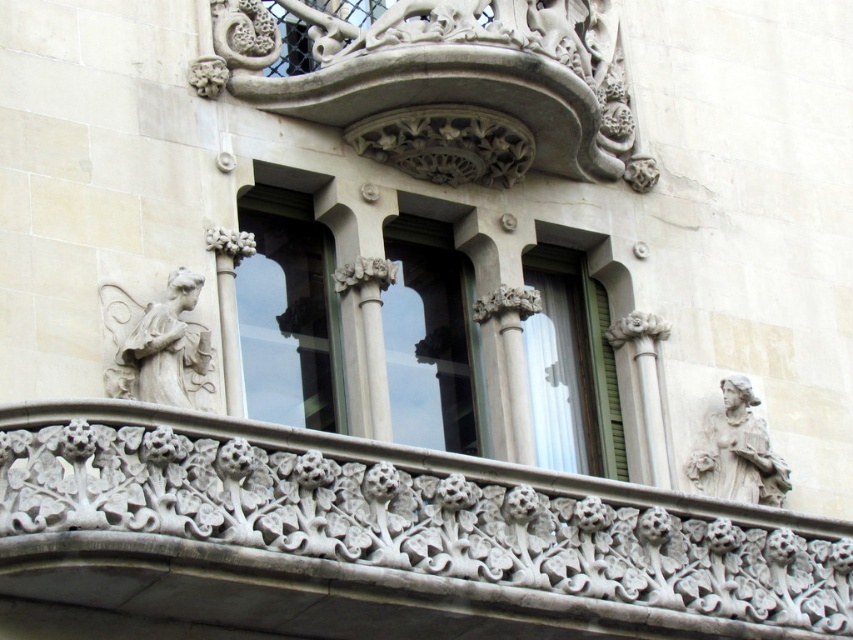
Find the location of a particular element. This screenshot has height=640, width=853. white stone carving at center is located at coordinates (386, 536).

Can you confirm if transparent glass window at center is positioned above clear glass window at center?

Correct, transparent glass window at center is located above clear glass window at center.

Is transparent glass window at center closer to the viewer compared to clear glass window at center?

No, transparent glass window at center is further to the viewer.

Is point (251, 212) less distant than point (469, 342)?

Yes.

This screenshot has height=640, width=853. Identify the location of transparent glass window at center. (288, 314).

Find the location of a particular element. The image size is (853, 640). transparent glass window at center is located at coordinates (288, 314).

Is point (259, 381) farther from viewer compared to point (126, 340)?

Yes, it is behind point (126, 340).

This screenshot has width=853, height=640. Identify the location of transparent glass window at center. (288, 314).